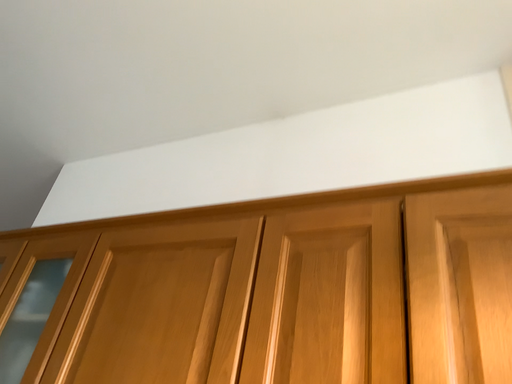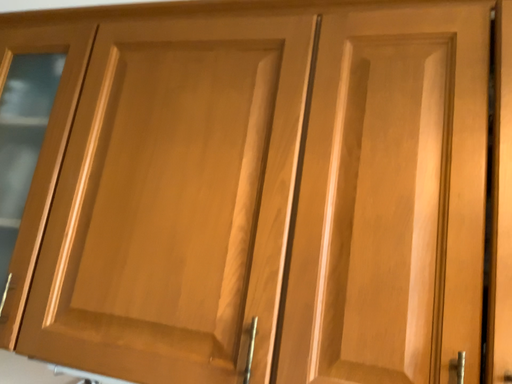
Question: Which way did the camera rotate in the video?

Choices:
 (A) rotated upward
 (B) rotated downward

Answer: (B)